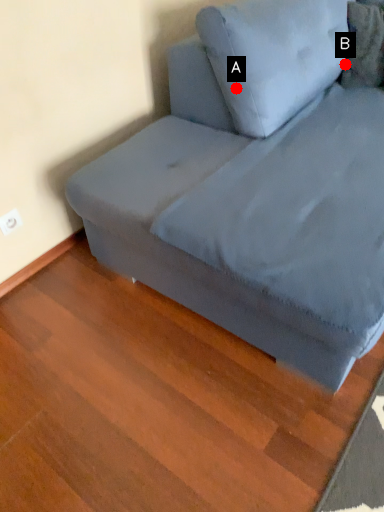
Question: Two points are circled on the image, labeled by A and B beside each circle. Which of the following is the farthest from the observer?

Choices:
 (A) A is further
 (B) B is further

Answer: (B)